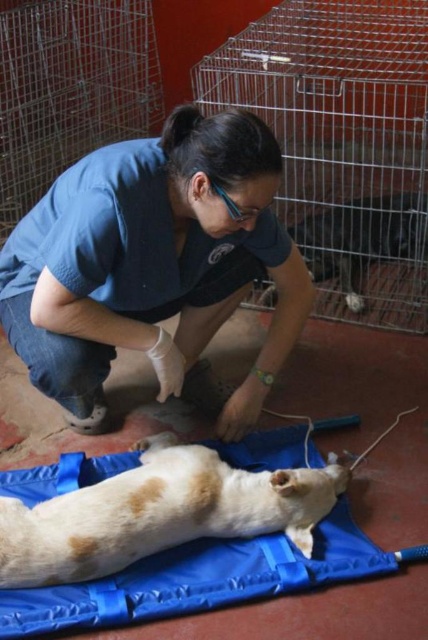
Question: Which object appears closest to the camera in this image?

Choices:
 (A) white fur dog at center
 (B) blue fabric at center

Answer: (B)

Question: Which point appears farthest from the camera in this image?

Choices:
 (A) (59, 573)
 (B) (196, 168)

Answer: (A)

Question: Is blue fabric at center wider than light brown fur at center?

Choices:
 (A) yes
 (B) no

Answer: (B)

Question: Estimate the real-world distances between objects in this image. Which object is farther from the light brown fur at center?

Choices:
 (A) blue fabric at center
 (B) white fur dog at center

Answer: (B)

Question: Can you confirm if blue fabric at center is bigger than light brown fur at center?

Choices:
 (A) yes
 (B) no

Answer: (A)

Question: Is blue fabric at center smaller than white fur dog at center?

Choices:
 (A) no
 (B) yes

Answer: (A)